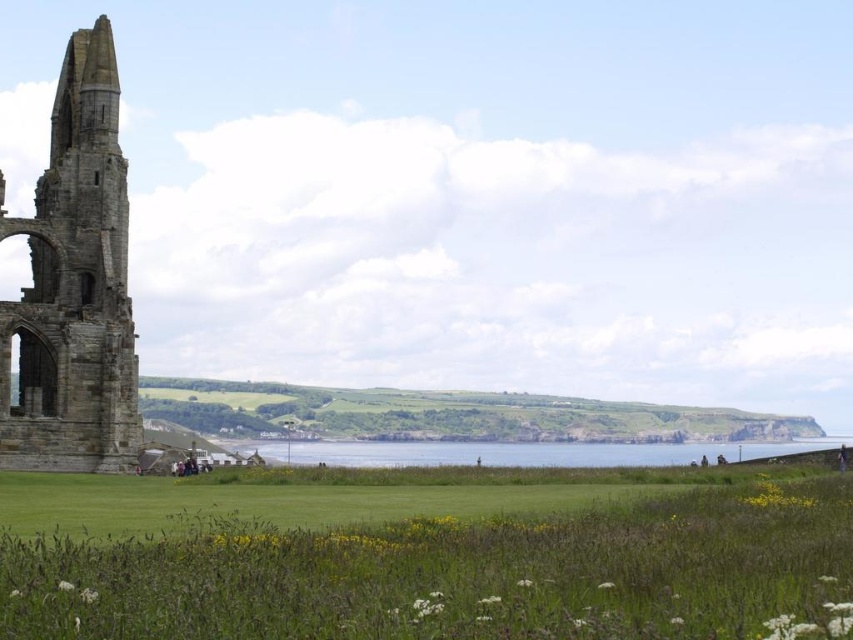
Question: Is green grassy field at lower center further to the viewer compared to clear blue water at center?

Choices:
 (A) yes
 (B) no

Answer: (B)

Question: Which of the following is the farthest from the observer?

Choices:
 (A) green grassy field at lower center
 (B) clear blue water at center
 (C) stone tower at left

Answer: (B)

Question: Can you confirm if green grassy field at lower center is thinner than clear blue water at center?

Choices:
 (A) yes
 (B) no

Answer: (B)

Question: Which is farther from the stone tower at left?

Choices:
 (A) clear blue water at center
 (B) green grassy field at lower center

Answer: (A)

Question: Which object is the farthest from the stone tower at left?

Choices:
 (A) green grassy field at lower center
 (B) clear blue water at center

Answer: (B)

Question: Is stone tower at left below clear blue water at center?

Choices:
 (A) yes
 (B) no

Answer: (B)